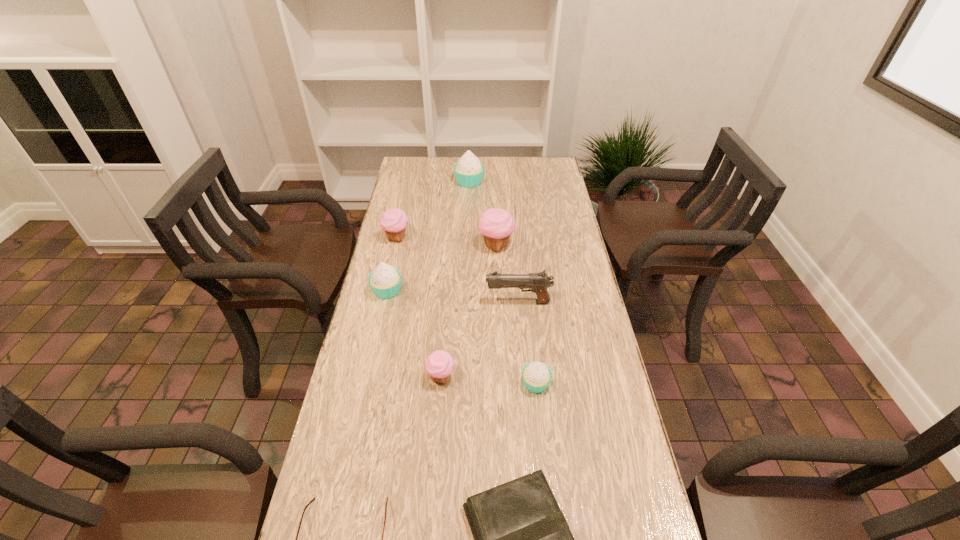
Where is `vacant area that lies between the gun and the smallest white cupcake`? The image size is (960, 540). vacant area that lies between the gun and the smallest white cupcake is located at coordinates (527, 343).

You are a GUI agent. You are given a task and a screenshot of the screen. Output one action in this format:
    pyautogui.click(x=<x>, y=<y>)
    Task: Click on the empty location between the leftmost pink cupcake and the second pink cupcake from right to left
    
    Given the screenshot: What is the action you would take?
    (420, 308)

Locate an element on the screen. free space between the smallest pink cupcake and the gray gun is located at coordinates (480, 340).

This screenshot has height=540, width=960. I want to click on the closest object to the smallest white cupcake, so click(x=440, y=364).

This screenshot has width=960, height=540. I want to click on object identified as the eighth closest to the rightmost pink cupcake, so click(x=314, y=498).

Image resolution: width=960 pixels, height=540 pixels. I want to click on cupcake that is the fourth closest to the nearest pink cupcake, so click(x=394, y=221).

Choose which cupcake is the fourth nearest neighbor to the book. Please provide its 2D coordinates. Your answer should be formatted as a tuple, i.e. [(x, y)], where the tuple contains the x and y coordinates of a point satisfying the conditions above.

[(496, 225)]

Find the location of a particular element. Image resolution: width=960 pixels, height=540 pixels. pink cupcake identified as the closest to the nearest white cupcake is located at coordinates (440, 364).

This screenshot has width=960, height=540. Find the location of `pink cupcake that stands as the second closest to the second biggest white cupcake`. pink cupcake that stands as the second closest to the second biggest white cupcake is located at coordinates (440, 364).

Select which white cupcake is the second closest to the nearest white cupcake. Please provide its 2D coordinates. Your answer should be formatted as a tuple, i.e. [(x, y)], where the tuple contains the x and y coordinates of a point satisfying the conditions above.

[(469, 171)]